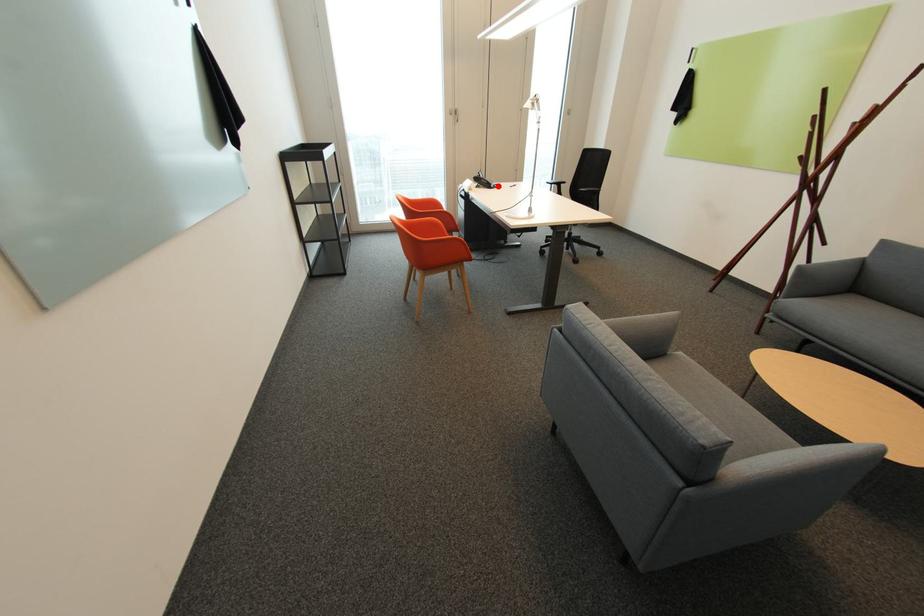
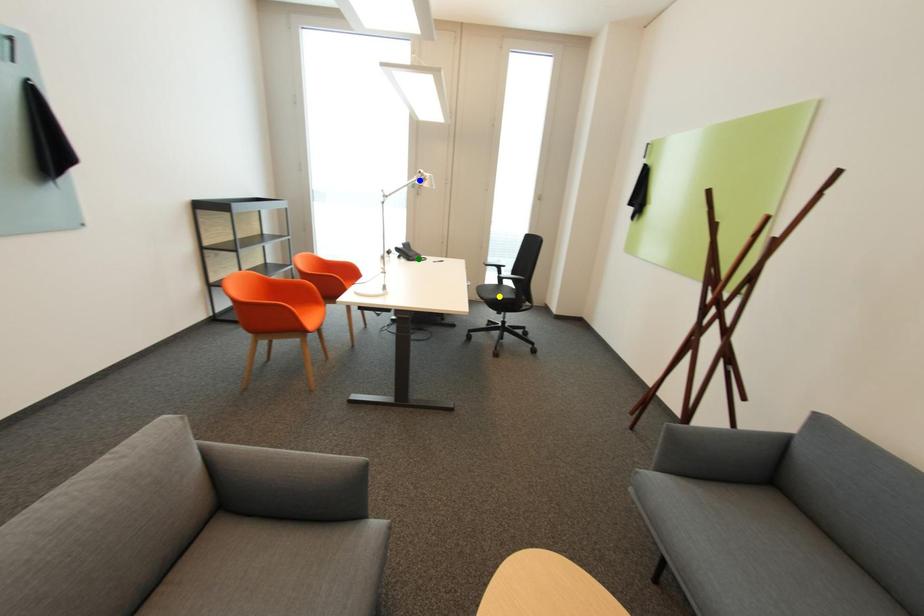
Question: I am providing you with two images of the same scene from different viewpoints. A red point is marked on the first image. You are given multiple points on the second image. Which point in image 2 is actually the same real-world point as the red point in image 1?

Choices:
 (A) blue point
 (B) green point
 (C) yellow point

Answer: (B)